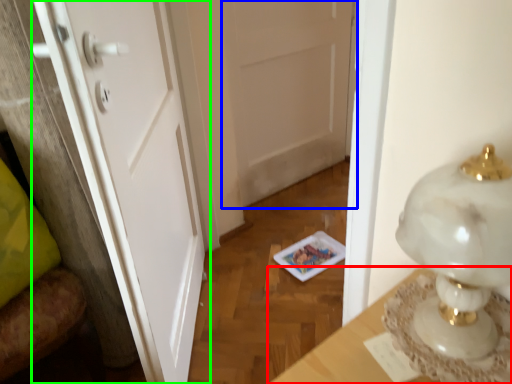
Question: Based on their relative distances, which object is farther from table (highlighted by a red box)? Choose from door (highlighted by a blue box) and door (highlighted by a green box).

Choices:
 (A) door
 (B) door

Answer: (A)